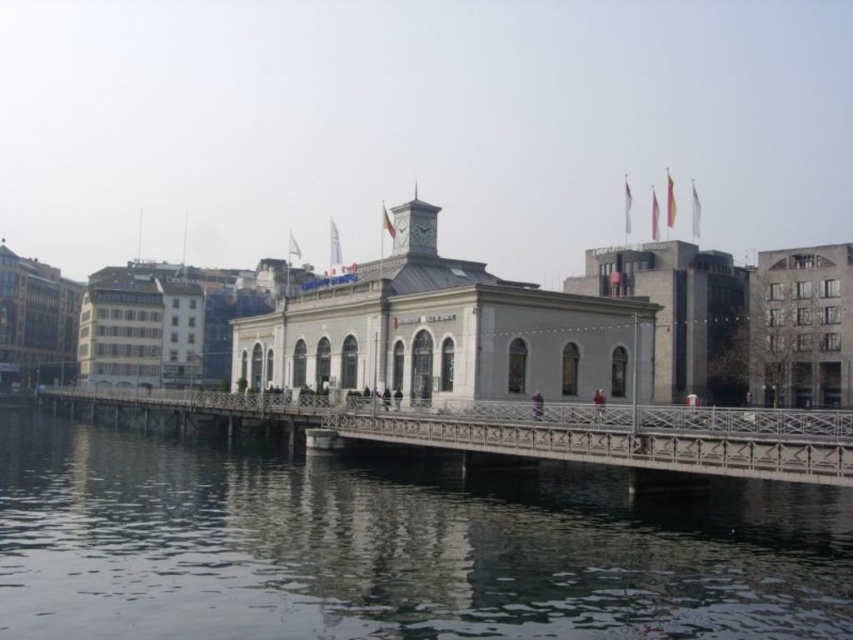
You are a photographer planning to capture the waterfront scene. You want to ensure that both the smooth dark water at lower center and the metallic gray bridge at center are clearly visible in your shot. Based on their sizes in the image, which object should you prioritize positioning closer to the camera to ensure it doesn

The smooth dark water at lower center is thinner than the metallic gray bridge at center. To ensure both are clearly visible, prioritize positioning the smooth dark water at lower center closer to the camera since it is smaller and might be less prominent in the frame.

You are standing on the dock at the waterfront scene and see the point marked at coordinates (x=393, y=547). What is the surface condition of the area where this point is located?

The point at (x=393, y=547) is located on smooth dark water at lower center, so the surface condition there is smooth and dark.